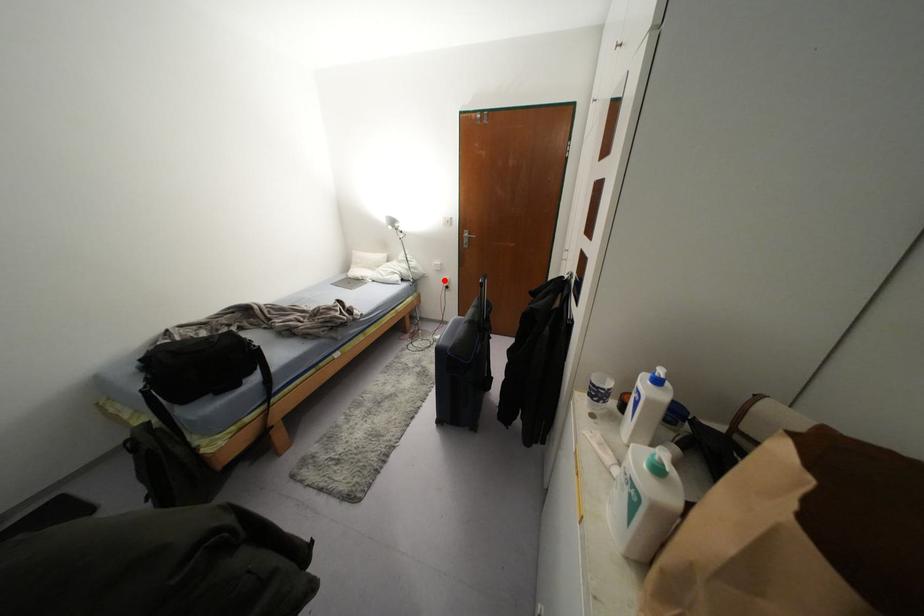
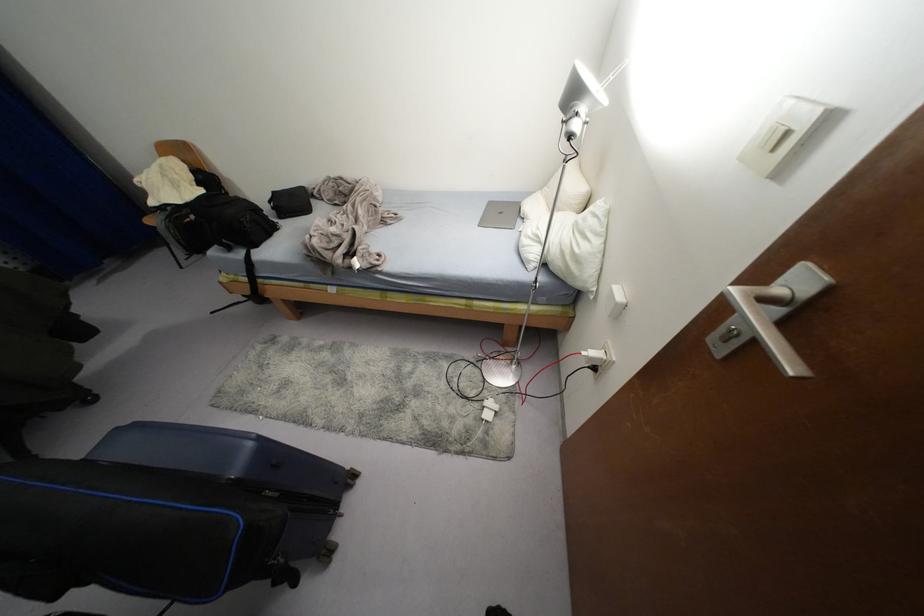
Question: I am providing you with two images of the same scene from different viewpoints. Image1 has a red point marked. In image2, the corresponding 3D location appears at what relative position? Reply with the corresponding letter.

Choices:
 (A) Closer
 (B) Farther

Answer: (A)